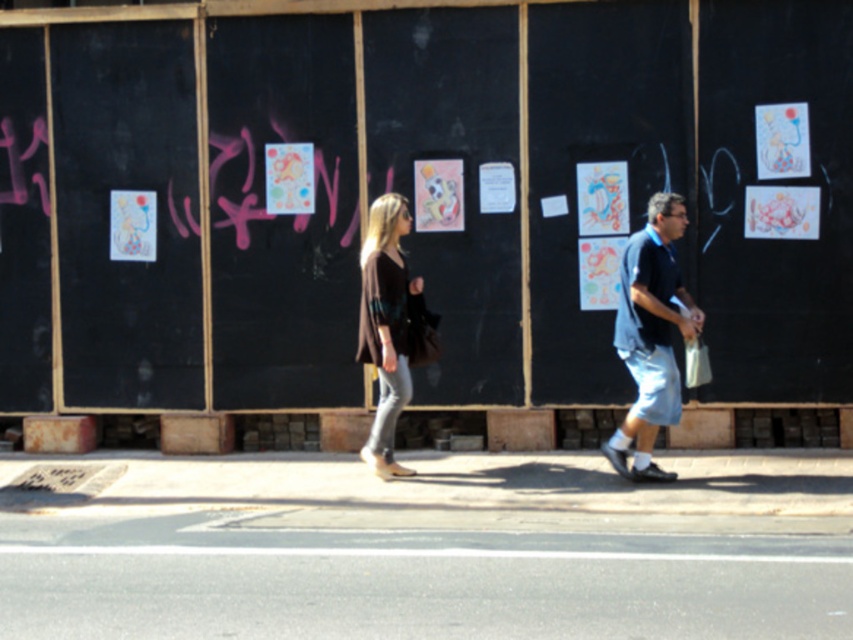
Is gray asphalt at lower center below brown textured sweater at center?

Yes, gray asphalt at lower center is below brown textured sweater at center.

Does gray asphalt at lower center come in front of brown textured sweater at center?

Yes.

Image resolution: width=853 pixels, height=640 pixels. Find the location of `gray asphalt at lower center`. gray asphalt at lower center is located at coordinates (427, 547).

Where is `gray asphalt at lower center`? Image resolution: width=853 pixels, height=640 pixels. gray asphalt at lower center is located at coordinates (427, 547).

Based on the photo, who is positioned more to the right, gray asphalt at lower center or blue cotton shirt at center?

blue cotton shirt at center is more to the right.

The width and height of the screenshot is (853, 640). Find the location of `gray asphalt at lower center`. gray asphalt at lower center is located at coordinates (427, 547).

This screenshot has height=640, width=853. Identify the location of gray asphalt at lower center. (427, 547).

Which is below, black matte bulletin board at center or matte brown sweater at center?

black matte bulletin board at center

Between point (283, 131) and point (373, 221), which one is positioned in front?

Positioned in front is point (373, 221).

What are the coordinates of `black matte bulletin board at center` in the screenshot? It's located at (418, 193).